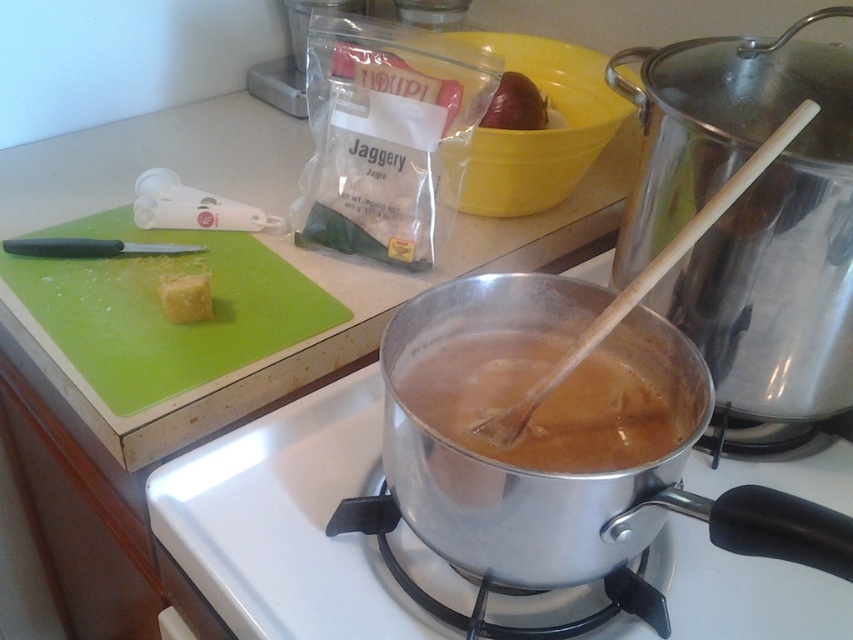
You are standing in the kitchen and want to reach both the point at the stovetop labeled as point (840, 609) and the point labeled as (477, 445). Which point is closer to you?

Point (840, 609) is further to the viewer than point (477, 445), so the point labeled (477, 445) is closer to you.

You are a chef standing in front of the kitchen stovetop. You need to reach for an ingredient located at point (709, 484) and another at point (172, 358). Which point will you reach first if you move towards them directly?

Point (709, 484) is closer to the camera than point (172, 358), so you will reach point (709, 484) first.

You are a chef standing at the kitchen counter and want to reach the silver metallic pot at center to stir the contents. Your arm can extend 20 inches. Can you reach it?

The silver metallic pot at center is 21.40 inches away from the camera, which is beyond your arm extension of 20 inches. You cannot reach it without moving closer.